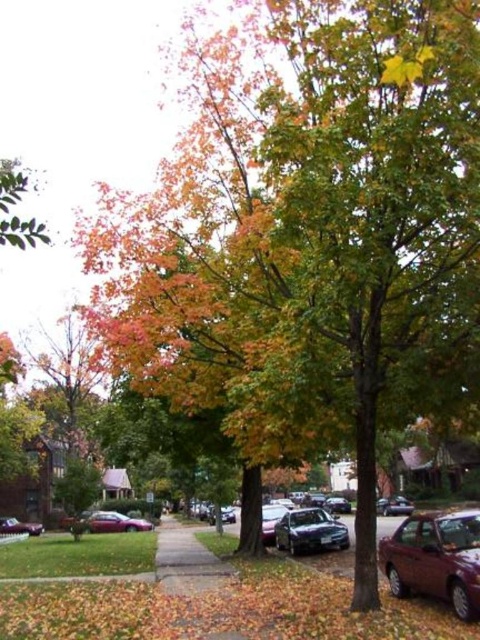
Between shiny maroon sedan at lower right and gray concrete sidewalk at center, which one appears on the left side from the viewer's perspective?

gray concrete sidewalk at center is more to the left.

Which is in front, point (441, 566) or point (217, 573)?

Point (441, 566) is in front.

Where is `shiny maroon sedan at lower right`? shiny maroon sedan at lower right is located at coordinates (435, 557).

Locate an element on the screen. shiny maroon sedan at lower right is located at coordinates (435, 557).

Who is more distant from viewer, (297, 538) or (7, 516)?

Positioned behind is point (7, 516).

Which is more to the left, satin black sedan at center or shiny silver sedan at lower left?

From the viewer's perspective, shiny silver sedan at lower left appears more on the left side.

Who is more distant from viewer, (288,545) or (28,534)?

Point (28,534)

This screenshot has height=640, width=480. In order to click on satin black sedan at center in this screenshot , I will do `click(310, 531)`.

Between satin black sedan at center and metallic silver sedan at center, which one appears on the right side from the viewer's perspective?

From the viewer's perspective, satin black sedan at center appears more on the right side.

Which is more to the left, satin black sedan at center or metallic silver sedan at center?

metallic silver sedan at center is more to the left.

Identify the location of satin black sedan at center. (310, 531).

The width and height of the screenshot is (480, 640). What are the coordinates of `satin black sedan at center` in the screenshot? It's located at (310, 531).